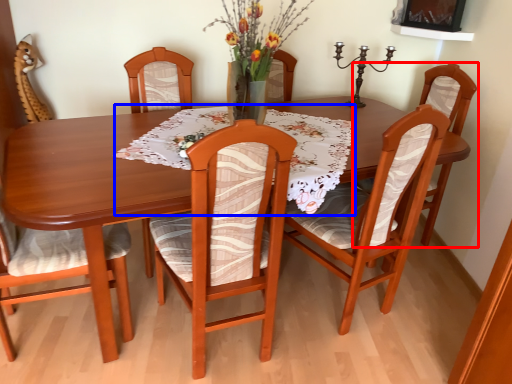
Question: Which object appears closest to the camera in this image, chair (highlighted by a red box) or tablecloth (highlighted by a blue box)?

Choices:
 (A) chair
 (B) tablecloth

Answer: (B)